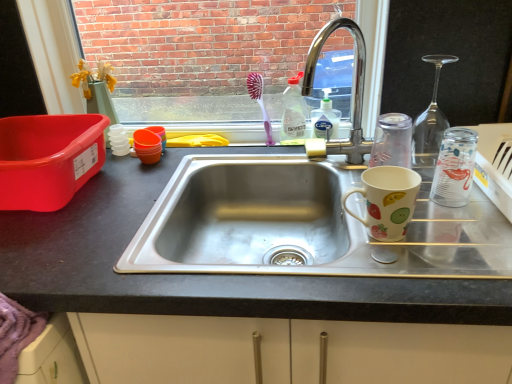
Locate an element on the screen. The height and width of the screenshot is (384, 512). free space in front of transparent glass bottle at right, marked as the first bottle in a bottom-to-top arrangement is located at coordinates (466, 242).